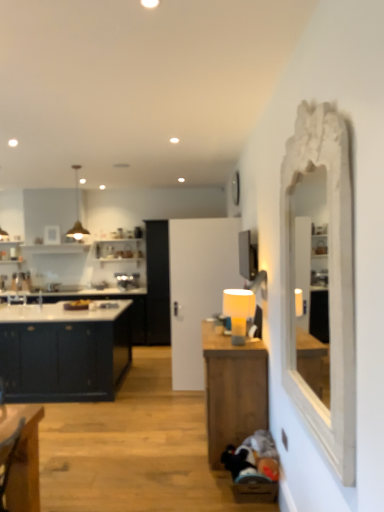
Question: From the image's perspective, is metallic pendant light at upper left beneath matte yellow lampshade at center-right?

Choices:
 (A) no
 (B) yes

Answer: (A)

Question: Can you confirm if metallic pendant light at upper left is positioned to the right of matte yellow lampshade at center-right?

Choices:
 (A) no
 (B) yes

Answer: (A)

Question: Can you confirm if metallic pendant light at upper left is wider than matte yellow lampshade at center-right?

Choices:
 (A) yes
 (B) no

Answer: (A)

Question: Does metallic pendant light at upper left have a lesser width compared to matte yellow lampshade at center-right?

Choices:
 (A) yes
 (B) no

Answer: (B)

Question: Considering the relative sizes of metallic pendant light at upper left and matte yellow lampshade at center-right in the image provided, is metallic pendant light at upper left shorter than matte yellow lampshade at center-right?

Choices:
 (A) no
 (B) yes

Answer: (A)

Question: Does metallic pendant light at upper left lie behind matte yellow lampshade at center-right?

Choices:
 (A) yes
 (B) no

Answer: (A)

Question: Does metallic pendant light at upper left have a lesser width compared to matte dark blue cabinet at left?

Choices:
 (A) yes
 (B) no

Answer: (A)

Question: Is metallic pendant light at upper left behind matte dark blue cabinet at left?

Choices:
 (A) no
 (B) yes

Answer: (B)

Question: From the image's perspective, is metallic pendant light at upper left above matte dark blue cabinet at left?

Choices:
 (A) no
 (B) yes

Answer: (B)

Question: Is matte dark blue cabinet at left inside metallic pendant light at upper left?

Choices:
 (A) no
 (B) yes

Answer: (A)

Question: From a real-world perspective, does metallic pendant light at upper left sit lower than matte dark blue cabinet at left?

Choices:
 (A) no
 (B) yes

Answer: (A)

Question: Is metallic pendant light at upper left next to matte dark blue cabinet at left and touching it?

Choices:
 (A) yes
 (B) no

Answer: (B)

Question: Can you confirm if matte yellow lampshade at center-right is taller than white carved mirror at right?

Choices:
 (A) yes
 (B) no

Answer: (B)